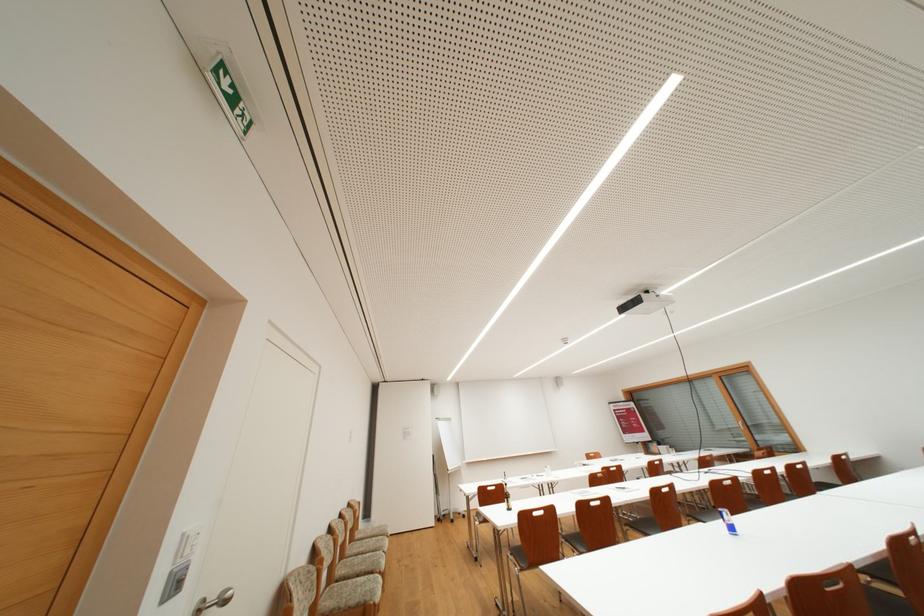
Find where to push the white light switch. Please return your answer as a coordinate pair (x, y).

(187, 544)